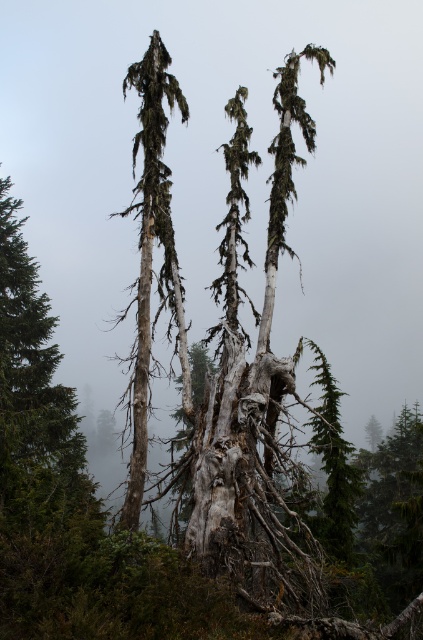
Where is `gray bark tree at center`? This screenshot has height=640, width=423. gray bark tree at center is located at coordinates (147, 237).

Does point (142, 76) come closer to viewer compared to point (332, 442)?

Yes.

Image resolution: width=423 pixels, height=640 pixels. Identify the location of gray bark tree at center. (147, 237).